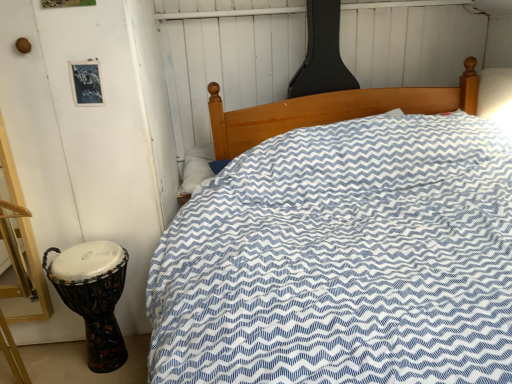
Question: Considering the relative positions of white soft pillow at center and multicolored fabric drum at left in the image provided, is white soft pillow at center behind multicolored fabric drum at left?

Choices:
 (A) no
 (B) yes

Answer: (B)

Question: Is multicolored fabric drum at left inside white soft pillow at center?

Choices:
 (A) yes
 (B) no

Answer: (B)

Question: Does white soft pillow at center have a smaller size compared to multicolored fabric drum at left?

Choices:
 (A) no
 (B) yes

Answer: (B)

Question: Considering the relative sizes of white soft pillow at center and multicolored fabric drum at left in the image provided, is white soft pillow at center wider than multicolored fabric drum at left?

Choices:
 (A) yes
 (B) no

Answer: (B)

Question: From the image's perspective, does white soft pillow at center appear lower than multicolored fabric drum at left?

Choices:
 (A) yes
 (B) no

Answer: (B)

Question: Can you confirm if white soft pillow at center is taller than multicolored fabric drum at left?

Choices:
 (A) no
 (B) yes

Answer: (A)

Question: From a real-world perspective, is multicolored fabric drum at left located higher than white soft pillow at center?

Choices:
 (A) no
 (B) yes

Answer: (A)

Question: Could you tell me if multicolored fabric drum at left is facing white soft pillow at center?

Choices:
 (A) no
 (B) yes

Answer: (A)

Question: Is multicolored fabric drum at left shorter than white soft pillow at center?

Choices:
 (A) no
 (B) yes

Answer: (A)

Question: Is white soft pillow at center at the back of multicolored fabric drum at left?

Choices:
 (A) no
 (B) yes

Answer: (A)

Question: Can you confirm if multicolored fabric drum at left is wider than white soft pillow at center?

Choices:
 (A) yes
 (B) no

Answer: (A)

Question: Can you see multicolored fabric drum at left touching white soft pillow at center?

Choices:
 (A) yes
 (B) no

Answer: (B)

Question: From a real-world perspective, is white soft pillow at center above or below multicolored fabric drum at left?

Choices:
 (A) below
 (B) above

Answer: (B)